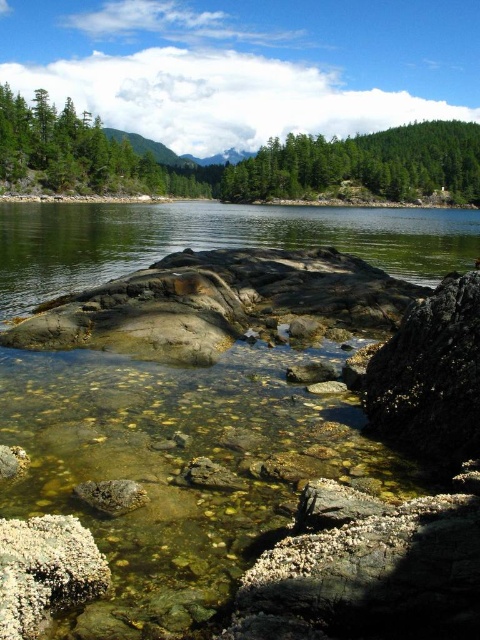
Consider the image. You are standing at the edge of the water and see two points marked in the scene. The first point is at coordinates point (394, 416) and the second is at point (6, 588). Which point is closer to your current position?

Point (6, 588) is closer to your current position because it is less further to the viewer than point (394, 416).

You are standing at the edge of the lake and see two points in the water. The first point is located at coordinates point (340, 156), and the second point is at point (0, 636). Which point is closer to you?

Point (340, 156) is further to the viewer than point (0, 636), so the closer point to you is point (0, 636).